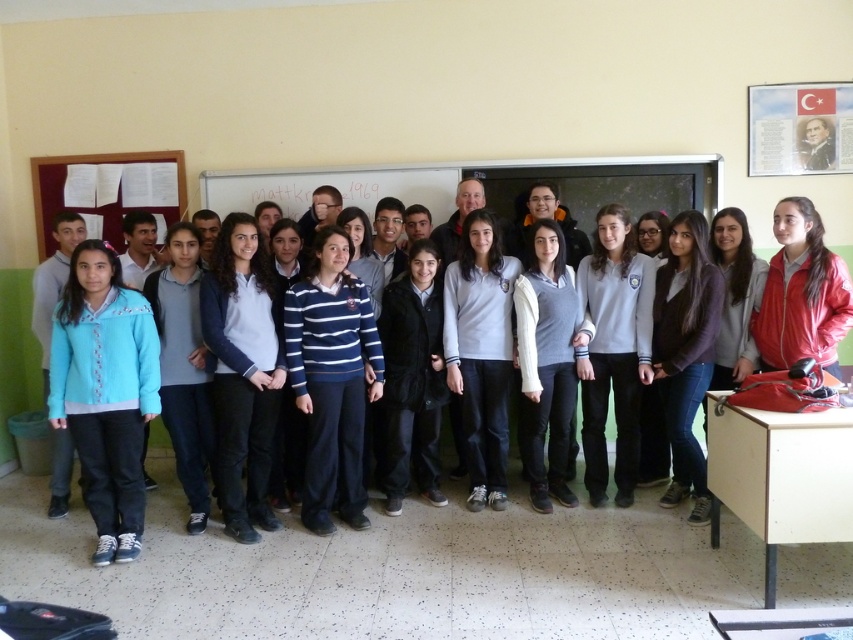
Question: Which object is the closest to the white paper at center?

Choices:
 (A) gray wool sweater at center
 (B) blue striped sweater at center
 (C) turquoise fleece jacket at left

Answer: (B)

Question: Can you confirm if blue striped sweater at center is thinner than gray wool sweater at center?

Choices:
 (A) yes
 (B) no

Answer: (B)

Question: Which of the following is the farthest from the observer?

Choices:
 (A) (102, 451)
 (B) (338, 257)
 (C) (521, 355)
 (D) (241, 196)

Answer: (D)

Question: Can you confirm if turquoise fleece jacket at left is positioned above gray wool sweater at center?

Choices:
 (A) yes
 (B) no

Answer: (B)

Question: Estimate the real-world distances between objects in this image. Which object is farther from the gray wool sweater at center?

Choices:
 (A) white paper at center
 (B) turquoise fleece jacket at left

Answer: (B)

Question: Is blue striped sweater at center smaller than gray wool sweater at center?

Choices:
 (A) no
 (B) yes

Answer: (A)